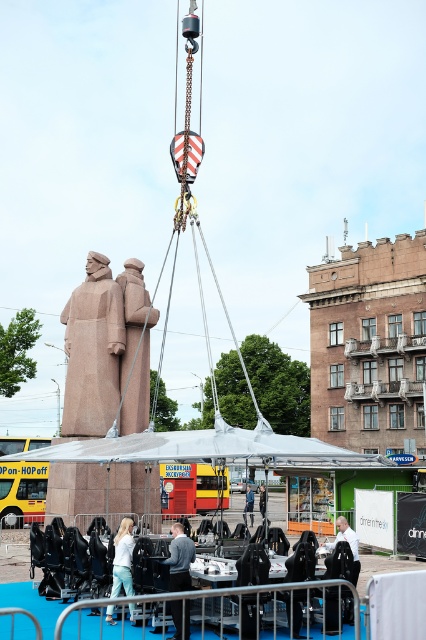
Question: Which point is closer to the camera?

Choices:
 (A) granite statue at center
 (B) dark gray suit at center
 (C) gray sweater at center

Answer: (C)

Question: Considering the real-world distances, which object is farthest from the light blue jeans at lower left?

Choices:
 (A) brown granite statue at center
 (B) blue fabric jacket at center
 (C) white shirt at center
 (D) granite statue at center

Answer: (B)

Question: Which object is closer to the camera taking this photo?

Choices:
 (A) brown granite statue at center
 (B) gray sweater at center
 (C) white shirt at center
 (D) granite statue at center

Answer: (B)

Question: Considering the relative positions of granite statue at center and white shirt at center in the image provided, where is granite statue at center located with respect to white shirt at center?

Choices:
 (A) right
 (B) left

Answer: (B)

Question: Is brown granite statue at center smaller than gray sweater at center?

Choices:
 (A) no
 (B) yes

Answer: (A)

Question: Does white shirt at center lie behind blue fabric jacket at center?

Choices:
 (A) yes
 (B) no

Answer: (B)